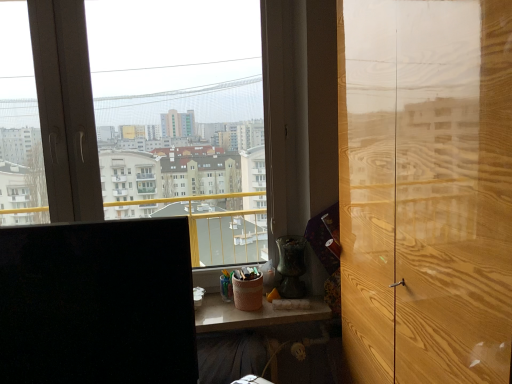
Question: Is black matte computer monitor at left taller than transparent glass window at center?

Choices:
 (A) yes
 (B) no

Answer: (B)

Question: Is black matte computer monitor at left wider than transparent glass window at center?

Choices:
 (A) yes
 (B) no

Answer: (A)

Question: Is black matte computer monitor at left turned away from transparent glass window at center?

Choices:
 (A) yes
 (B) no

Answer: (A)

Question: From a real-world perspective, is black matte computer monitor at left located beneath transparent glass window at center?

Choices:
 (A) yes
 (B) no

Answer: (A)

Question: Does black matte computer monitor at left have a lesser height compared to transparent glass window at center?

Choices:
 (A) yes
 (B) no

Answer: (A)

Question: Considering their positions, is transparent glass window at center located in front of or behind wooden table at lower center?

Choices:
 (A) front
 (B) behind

Answer: (B)

Question: Is transparent glass window at center situated inside wooden table at lower center or outside?

Choices:
 (A) outside
 (B) inside

Answer: (A)

Question: In the image, is transparent glass window at center on the left side or the right side of wooden table at lower center?

Choices:
 (A) right
 (B) left

Answer: (B)

Question: Based on their sizes in the image, would you say transparent glass window at center is bigger or smaller than wooden table at lower center?

Choices:
 (A) small
 (B) big

Answer: (B)

Question: Is wooden table at lower center bigger or smaller than light brown wood door at right?

Choices:
 (A) small
 (B) big

Answer: (A)

Question: Considering their positions, is wooden table at lower center located in front of or behind light brown wood door at right?

Choices:
 (A) front
 (B) behind

Answer: (B)

Question: Considering the positions of point pyautogui.click(x=237, y=354) and point pyautogui.click(x=352, y=119), is point pyautogui.click(x=237, y=354) closer or farther from the camera than point pyautogui.click(x=352, y=119)?

Choices:
 (A) farther
 (B) closer

Answer: (A)

Question: Is wooden table at lower center situated inside light brown wood door at right or outside?

Choices:
 (A) outside
 (B) inside

Answer: (A)

Question: From a real-world perspective, relative to black matte computer monitor at left, is wooden table at lower center vertically above or below?

Choices:
 (A) below
 (B) above

Answer: (A)

Question: From the image's perspective, is wooden table at lower center located above or below black matte computer monitor at left?

Choices:
 (A) below
 (B) above

Answer: (A)